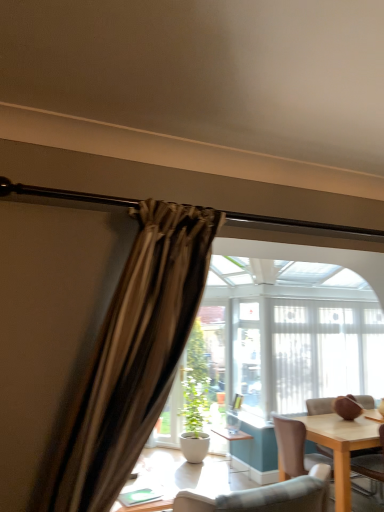
This screenshot has height=512, width=384. What are the coordinates of `white sheer curtain at center` in the screenshot? It's located at (305, 352).

What do you see at coordinates (371, 467) in the screenshot?
I see `wooden chair at right` at bounding box center [371, 467].

Find the location of a particular element. This screenshot has width=384, height=512. white matte pot at center is located at coordinates (195, 398).

This screenshot has height=512, width=384. I want to click on white sheer curtain at center, so click(x=305, y=352).

You are a GUI agent. You are given a task and a screenshot of the screen. Output one action in this format:
    pyautogui.click(x=<x>, y=<y>)
    Task: Click on the houseplant to the left of wooden chair at right
    
    Given the screenshot: What is the action you would take?
    pyautogui.click(x=195, y=398)

From the image's perspective, is wooden chair at right located above or below white matte pot at center?

wooden chair at right is situated higher than white matte pot at center in the image.

Would you say white matte pot at center is part of wooden chair at right's contents?

No.

Is wooden chair at right turned away from white matte pot at center?

No, wooden chair at right is not facing the opposite direction of white matte pot at center.

Which of these two, white matte pot at center or wooden chair at right, is bigger?

With larger size is white matte pot at center.

Is there a large distance between white matte pot at center and wooden chair at right?

Yes, white matte pot at center and wooden chair at right are located far from each other.

Is point (190, 418) closer to camera compared to point (381, 483)?

No, (190, 418) is behind (381, 483).

Between white sheer curtain at center and white matte pot at center, which one has smaller size?

white matte pot at center.

Is white sheer curtain at center next to white matte pot at center?

No, white sheer curtain at center is not touching white matte pot at center.

In terms of height, does white sheer curtain at center look taller or shorter compared to white matte pot at center?

white sheer curtain at center is taller than white matte pot at center.

Does point (278, 361) come behind point (191, 449)?

Yes, point (278, 361) is farther from viewer.

Locate an element on the screen. window frame on the right of white matte pot at center is located at coordinates (305, 352).

Which of these two, white matte pot at center or white sheer curtain at center, is thinner?

With smaller width is white sheer curtain at center.

From a real-world perspective, relative to white sheer curtain at center, is white matte pot at center vertically above or below?

white matte pot at center is situated lower than white sheer curtain at center in the real world.

What's the angular difference between white matte pot at center and white sheer curtain at center's facing directions?

white matte pot at center and white sheer curtain at center are facing 38.9 degrees away from each other.

How different are the orientations of wooden chair at right and white sheer curtain at center in degrees?

180 degrees separate the facing orientations of wooden chair at right and white sheer curtain at center.

Is wooden chair at right wider than white sheer curtain at center?

Yes, wooden chair at right is wider than white sheer curtain at center.

Considering the relative positions of wooden chair at right and white sheer curtain at center in the image provided, is wooden chair at right to the left of white sheer curtain at center from the viewer's perspective?

Indeed, wooden chair at right is positioned on the left side of white sheer curtain at center.

Based on the photo, can you see wooden chair at right touching white sheer curtain at center?

No, wooden chair at right is not beside white sheer curtain at center.

Which of these two, white sheer curtain at center or wooden chair at right, is smaller?

wooden chair at right is smaller.

From a real-world perspective, is white sheer curtain at center physically located above or below wooden chair at right?

Clearly, from a real-world perspective, white sheer curtain at center is above wooden chair at right.

Considering the sizes of objects white sheer curtain at center and wooden chair at right in the image provided, who is shorter, white sheer curtain at center or wooden chair at right?

Standing shorter between the two is wooden chair at right.

Looking at this image, is white sheer curtain at center further to the viewer compared to wooden chair at right?

Yes, it is.

This screenshot has height=512, width=384. I want to click on houseplant below the wooden chair at right (from the image's perspective), so click(x=195, y=398).

At what (x,y) coordinates should I click in order to perform the action: click on chair on the right of white matte pot at center. Please return your answer as a coordinate pair (x, y). Looking at the image, I should click on (371, 467).

Which object lies nearer to the anchor point wooden chair at right, white matte pot at center or white sheer curtain at center?

white sheer curtain at center is positioned closer to the anchor wooden chair at right.

Which object lies further to the anchor point white matte pot at center, white sheer curtain at center or wooden chair at right?

wooden chair at right is further to white matte pot at center.

From the image, which object appears to be nearer to white sheer curtain at center, white matte pot at center or wooden chair at right?

white matte pot at center is closer to white sheer curtain at center.

Considering their positions, is wooden chair at right positioned further to white matte pot at center than white sheer curtain at center?

wooden chair at right is positioned further to the anchor white matte pot at center.

Estimate the real-world distances between objects in this image. Which object is further from white sheer curtain at center, wooden chair at right or white matte pot at center?

wooden chair at right.

Looking at the image, which one is located further to wooden chair at right, white sheer curtain at center or white matte pot at center?

white matte pot at center lies further to wooden chair at right than the other object.

This screenshot has height=512, width=384. In order to click on chair situated between white matte pot at center and white sheer curtain at center from left to right in this screenshot , I will do `click(371, 467)`.